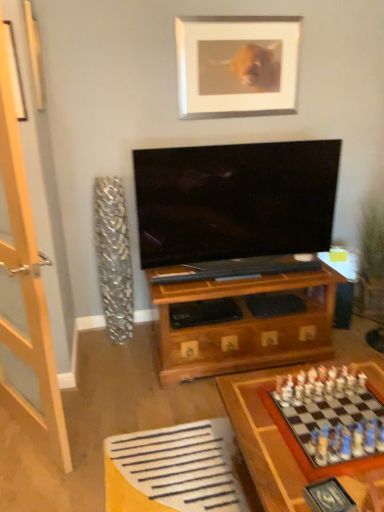
I want to click on free space above silver metallic picture frame at upper center (from a real-world perspective), so click(241, 14).